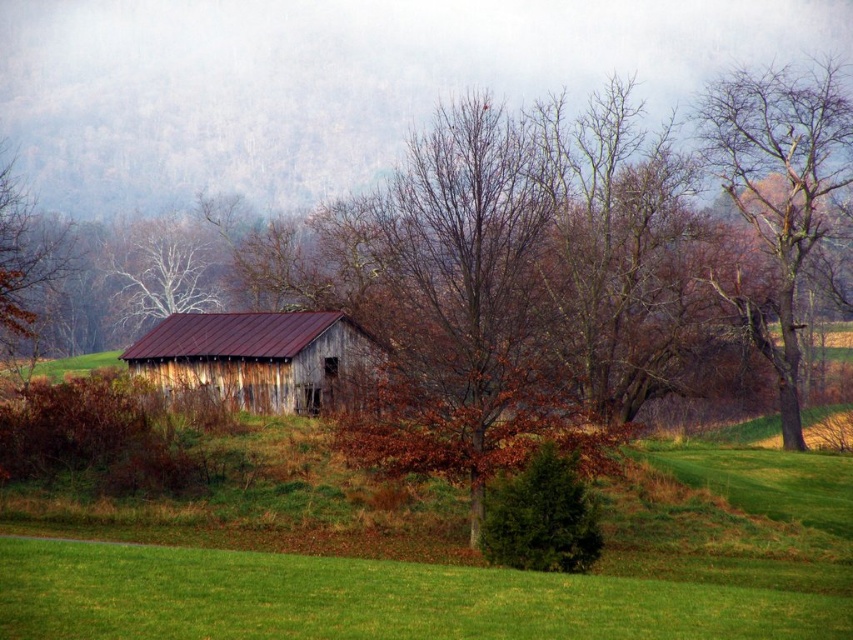
Question: Is bare wood tree at upper right above weathered wood barn at center?

Choices:
 (A) no
 (B) yes

Answer: (B)

Question: Which point appears closest to the camera in this image?

Choices:
 (A) (762, 88)
 (B) (148, 365)

Answer: (B)

Question: Is bare wood tree at upper right closer to camera compared to weathered wood barn at center?

Choices:
 (A) no
 (B) yes

Answer: (A)

Question: Does bare wood tree at upper right appear over weathered wood barn at center?

Choices:
 (A) no
 (B) yes

Answer: (B)